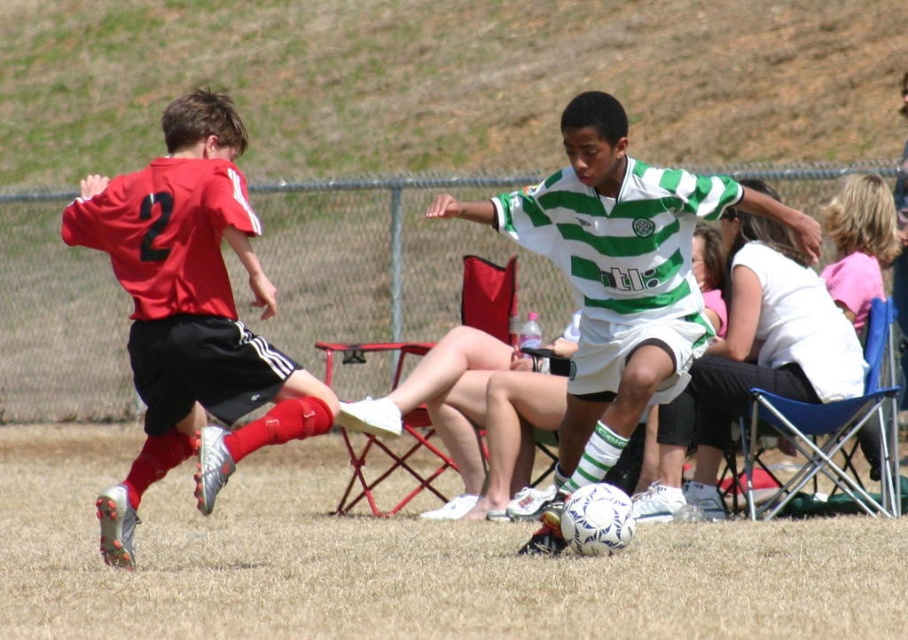
You are a referee at a youth soccer match. You need to determine if the players are within the required 5 feet distance for a foul during a tackle. Are the matte red jersey at left and green striped jersey at center within the 5 feet distance?

The matte red jersey at left is 4.33 feet away from green striped jersey at center, which is within the 5 feet distance required for a foul during a tackle.

You are a referee observing the soccer match. You notice the white matte soccer ball at center and the green striped jersey at center. Which object has a greater width?

The white matte soccer ball at center has a greater width than the green striped jersey at center.

Based on the scene description, where is the white matte soccer ball at center located in terms of coordinates?

The white matte soccer ball at center is located at coordinates point (191,316).